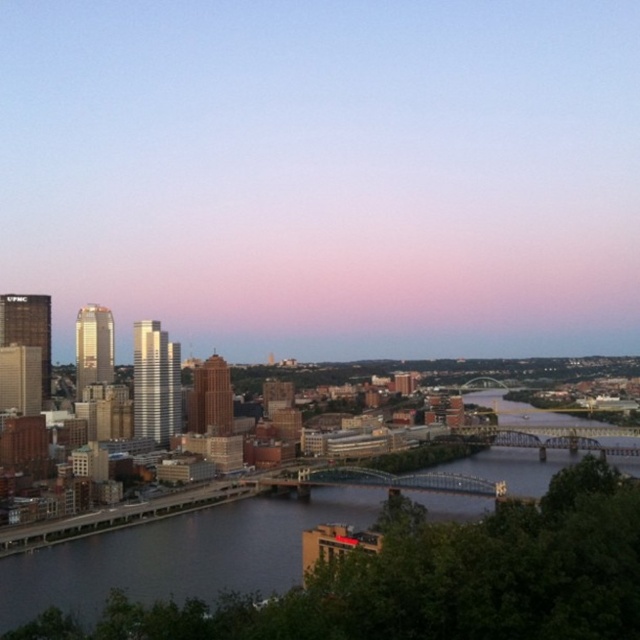
Looking at the cityscape with the pink gradient sky at upper center and dark blue water at center, which of these two elements takes up more visual space in the image?

The pink gradient sky at upper center takes up more visual space than the dark blue water at center because it is bigger in the image.

You are an architect designing a new observation deck. You want to ensure visitors can see both the pink gradient sky at upper center and the dark blue water at center. Based on their positions, which object will appear closer to the visitors when they look through the deck?

The pink gradient sky at upper center will appear closer to the visitors because it is positioned further to the viewer than the dark blue water at center.